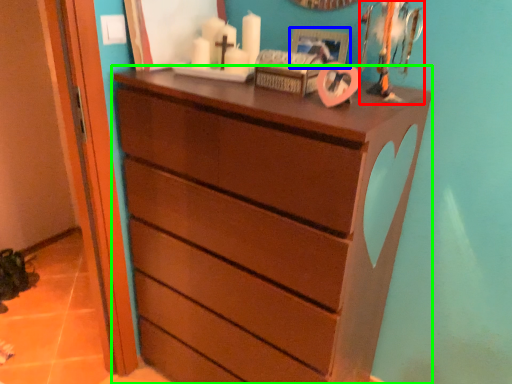
Question: Which object is positioned closest to toy (highlighted by a red box)? Select from picture frame (highlighted by a blue box) and chest of drawers (highlighted by a green box).

Choices:
 (A) picture frame
 (B) chest of drawers

Answer: (A)